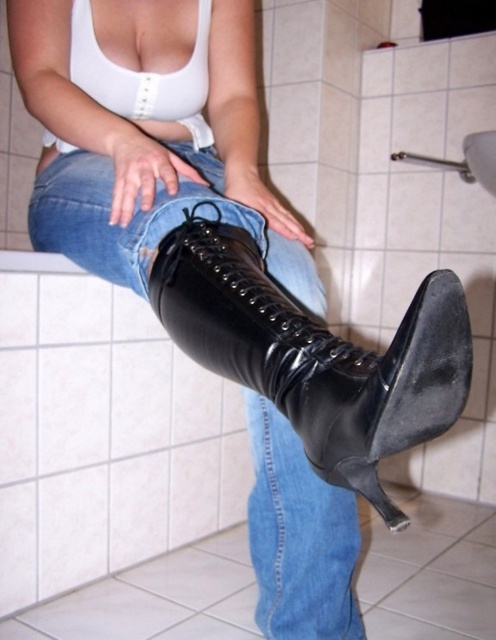
Question: Can you confirm if black patent leather boot at center is positioned above jeans at center?

Choices:
 (A) yes
 (B) no

Answer: (A)

Question: Which of the following is the closest to the observer?

Choices:
 (A) (33, 204)
 (B) (203, 321)

Answer: (B)

Question: Is black patent leather boot at center positioned before jeans at center?

Choices:
 (A) no
 (B) yes

Answer: (B)

Question: Among these objects, which one is farthest from the camera?

Choices:
 (A) black patent leather boot at center
 (B) jeans at center

Answer: (B)

Question: Among these points, which one is farthest from the camera?

Choices:
 (A) (443, 291)
 (B) (295, 636)

Answer: (B)

Question: Can you confirm if black patent leather boot at center is thinner than jeans at center?

Choices:
 (A) no
 (B) yes

Answer: (B)